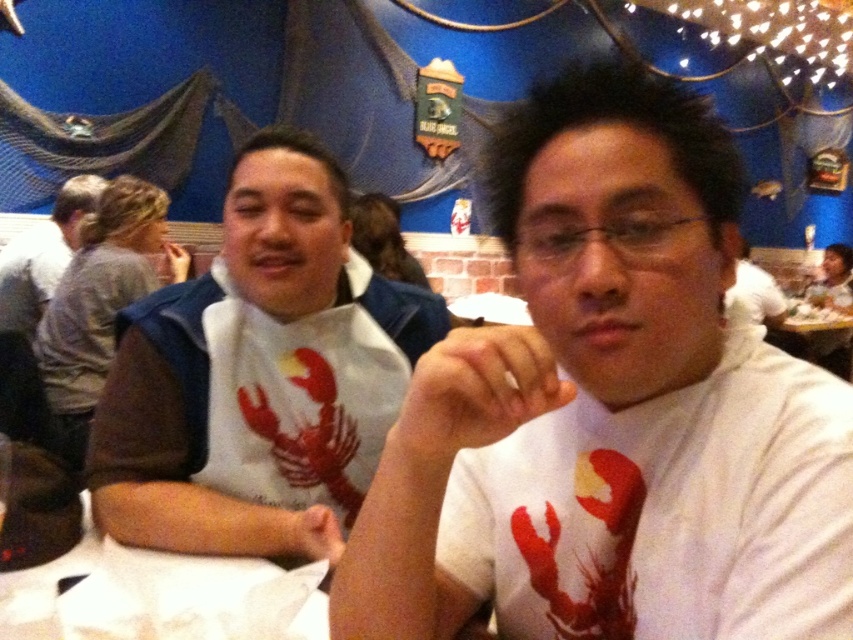
Who is shorter, white matte t-shirt at center or gray fabric shirt at left?

white matte t-shirt at center

Who is more distant from viewer, (583, 540) or (54, 218)?

Point (54, 218)

Where is `white matte t-shirt at center`? Image resolution: width=853 pixels, height=640 pixels. white matte t-shirt at center is located at coordinates (608, 410).

Is white matte t-shirt at center in front of white fabric shirt at left?

Yes.

Is white matte t-shirt at center bigger than white fabric shirt at left?

Incorrect, white matte t-shirt at center is not larger than white fabric shirt at left.

Find the location of a particular element. This screenshot has width=853, height=640. white matte t-shirt at center is located at coordinates (608, 410).

Image resolution: width=853 pixels, height=640 pixels. I want to click on white matte t-shirt at center, so click(608, 410).

Between white fabric shirt at left and gray fabric shirt at left, which one appears on the left side from the viewer's perspective?

Positioned to the left is gray fabric shirt at left.

Measure the distance between white fabric shirt at left and gray fabric shirt at left.

white fabric shirt at left and gray fabric shirt at left are 1.92 meters apart from each other.

Locate an element on the screen. The image size is (853, 640). white fabric shirt at left is located at coordinates (219, 477).